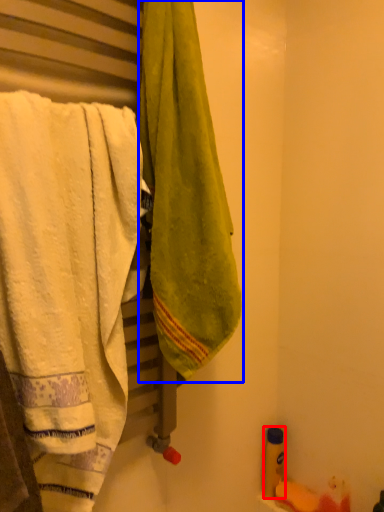
Question: Which object is closer to the camera taking this photo, toiletry (highlighted by a red box) or towel (highlighted by a blue box)?

Choices:
 (A) toiletry
 (B) towel

Answer: (B)